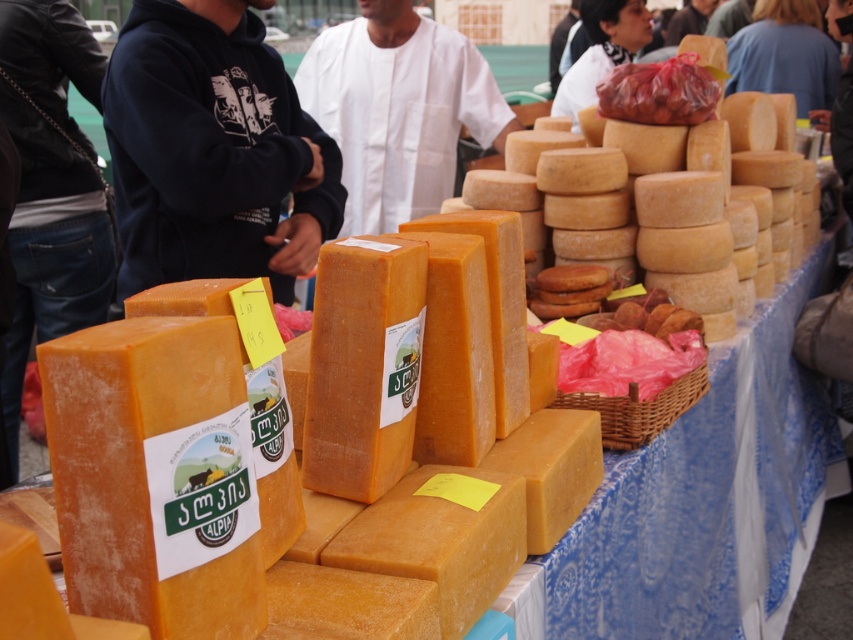
Which is more to the left, dark blue hoodie at center or orange hard cheese at center?

Positioned to the left is dark blue hoodie at center.

Who is positioned more to the right, dark blue hoodie at center or orange hard cheese at center?

Positioned to the right is orange hard cheese at center.

Does point (144, 24) lie in front of point (450, 301)?

No, (144, 24) is behind (450, 301).

At what (x,y) coordinates should I click in order to perform the action: click on dark blue hoodie at center. Please return your answer as a coordinate pair (x, y). This screenshot has height=640, width=853. Looking at the image, I should click on (212, 150).

From the picture: Is dark blue hoodie at center thinner than white cloth at center?

Yes.

Between point (158, 232) and point (368, 193), which one is positioned in front?

Point (158, 232)

Who is more forward, (184, 168) or (350, 188)?

Positioned in front is point (184, 168).

The width and height of the screenshot is (853, 640). I want to click on dark blue hoodie at center, so click(212, 150).

Between orange hard cheese at center and white cloth at center, which one appears on the right side from the viewer's perspective?

Positioned to the right is orange hard cheese at center.

The width and height of the screenshot is (853, 640). What do you see at coordinates (474, 440) in the screenshot?
I see `orange hard cheese at center` at bounding box center [474, 440].

The width and height of the screenshot is (853, 640). Identify the location of orange hard cheese at center. (474, 440).

Find the location of a particular element. The height and width of the screenshot is (640, 853). orange hard cheese at center is located at coordinates (474, 440).